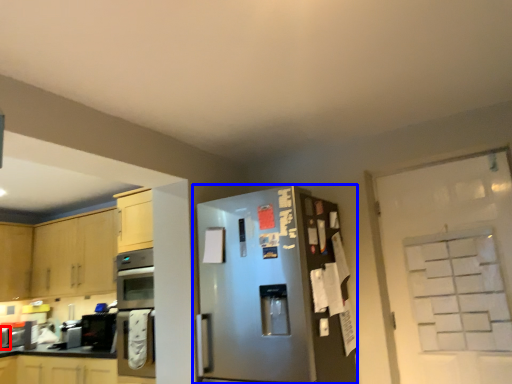
Question: Which object is further to the camera taking this photo, appliance (highlighted by a red box) or refrigerator (highlighted by a blue box)?

Choices:
 (A) appliance
 (B) refrigerator

Answer: (A)